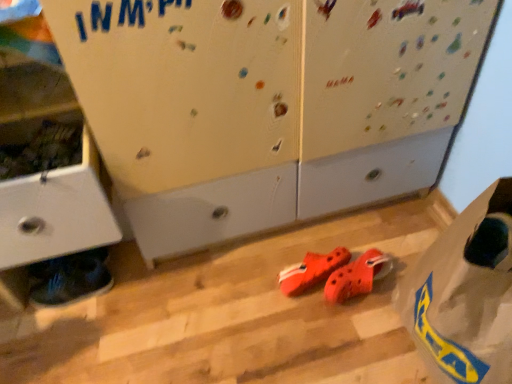
Where is `vacant area that lies between orange rubber clogs at center, the 3th footwear in the left-to-right sequence, and shiny blue sneakers at lower left, which appears as the third footwear when viewed from the right`? vacant area that lies between orange rubber clogs at center, the 3th footwear in the left-to-right sequence, and shiny blue sneakers at lower left, which appears as the third footwear when viewed from the right is located at coordinates (203, 292).